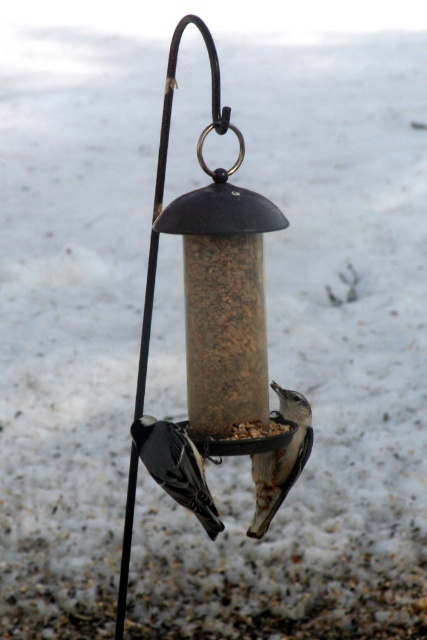
Which is above, black matte bird at lower left or white speckled bird at center?

Positioned higher is white speckled bird at center.

Is black matte bird at lower left positioned in front of white speckled bird at center?

Yes, it is.

Which is in front, point (136, 440) or point (260, 481)?

Point (136, 440) is more forward.

Locate an element on the screen. The image size is (427, 640). black matte bird at lower left is located at coordinates (175, 467).